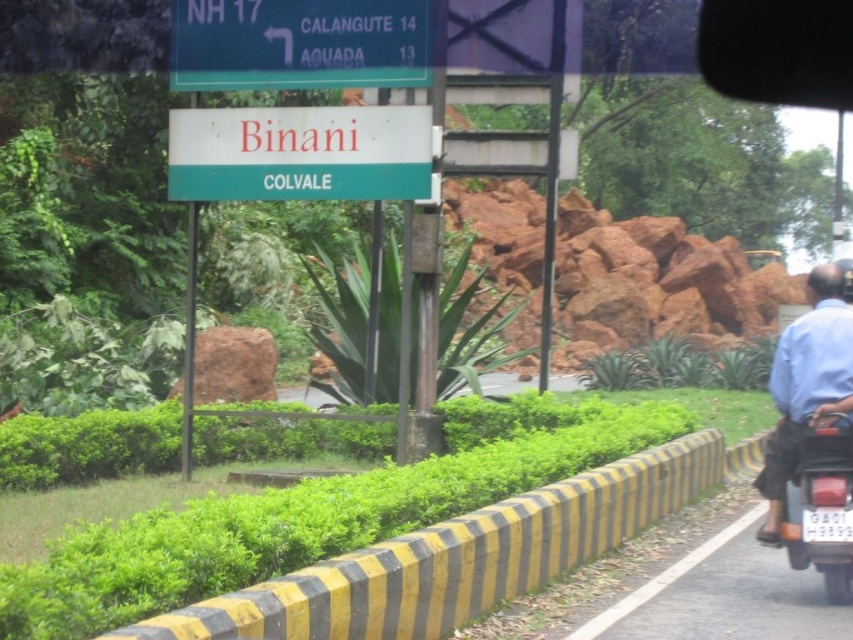
Can you confirm if blue cotton shirt at right is thinner than matte black motorcycle at right?

No, blue cotton shirt at right is not thinner than matte black motorcycle at right.

Which is in front, point (793, 333) or point (844, 584)?

Point (844, 584)

Locate an element on the screen. This screenshot has height=640, width=853. blue cotton shirt at right is located at coordinates (807, 381).

Can you confirm if yellow/black striped barrier at center is taller than white matte sign at center?

No, yellow/black striped barrier at center is not taller than white matte sign at center.

Who is more distant from viewer, [572,538] or [345,120]?

Point [345,120]

Where is `yellow/black striped barrier at center`? yellow/black striped barrier at center is located at coordinates (457, 557).

What do you see at coordinates (457, 557) in the screenshot? This screenshot has height=640, width=853. I see `yellow/black striped barrier at center` at bounding box center [457, 557].

Does yellow/black striped barrier at center have a larger size compared to blue cotton shirt at right?

No.

Where is `yellow/black striped barrier at center`? yellow/black striped barrier at center is located at coordinates 457,557.